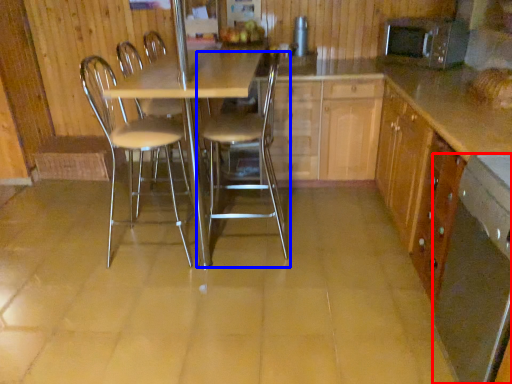
Question: Among these objects, which one is farthest to the camera, kitchen appliance (highlighted by a red box) or chair (highlighted by a blue box)?

Choices:
 (A) kitchen appliance
 (B) chair

Answer: (B)